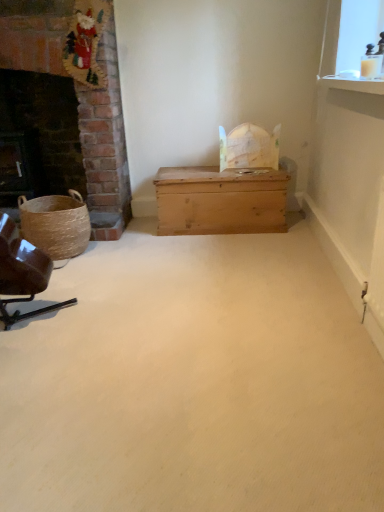
The height and width of the screenshot is (512, 384). What do you see at coordinates (220, 200) in the screenshot?
I see `light brown wooden chest at center` at bounding box center [220, 200].

In order to face brown leather chair at left, should I rotate leftwards or rightwards?

A 23.554 degree turn to the left will do.

At what (x,y) coordinates should I click in order to perform the action: click on dark brick fireplace at left. Please return your answer as a coordinate pair (x, y). The image size is (384, 512). Looking at the image, I should click on pyautogui.click(x=38, y=137).

Where is `woven brown basket at left`? woven brown basket at left is located at coordinates (56, 224).

In the image, is wooden trunk at center positioned in front of or behind light brown wooden chest at center?

wooden trunk at center is positioned closer to the viewer than light brown wooden chest at center.

Which is more to the right, wooden trunk at center or light brown wooden chest at center?

light brown wooden chest at center is more to the right.

What's the angular difference between wooden trunk at center and light brown wooden chest at center's facing directions?

The angle between the facing direction of wooden trunk at center and the facing direction of light brown wooden chest at center is 2.29 degrees.

Is wooden trunk at center turned away from light brown wooden chest at center?

That's not correct — wooden trunk at center is not looking away from light brown wooden chest at center.

Is brown leather chair at left to the right of woven brown basket at left from the viewer's perspective?

Correct, you'll find brown leather chair at left to the right of woven brown basket at left.

Considering the positions of point (3, 253) and point (68, 242), is point (3, 253) closer or farther from the camera than point (68, 242)?

Point (3, 253) is closer to the camera than point (68, 242).

Which object is thinner, brown leather chair at left or woven brown basket at left?

woven brown basket at left.

Which is behind, brown leather chair at left or woven brown basket at left?

woven brown basket at left is behind.

At what (x,y) coordinates should I click in order to perform the action: click on fireplace above the wooden trunk at center (from a real-world perspective). Please return your answer as a coordinate pair (x, y). Looking at the image, I should click on (38, 137).

Is wooden trunk at center placed right next to dark brick fireplace at left?

There is a gap between wooden trunk at center and dark brick fireplace at left.

Is point (339, 355) farther from viewer compared to point (73, 121)?

No.

Is wooden trunk at center further to the viewer compared to dark brick fireplace at left?

No, the depth of wooden trunk at center is less than that of dark brick fireplace at left.

Which of these two, wooden trunk at center or brown leather chair at left, is thinner?

With smaller width is brown leather chair at left.

From the image's perspective, is wooden trunk at center over brown leather chair at left?

No, from the image's perspective, wooden trunk at center is not on top of brown leather chair at left.

The width and height of the screenshot is (384, 512). In the image, there is a wooden trunk at center. What are the coordinates of `chair above it (from the image's perspective)` in the screenshot? It's located at (22, 273).

From a real-world perspective, is wooden trunk at center on brown leather chair at left?

No, from a real-world perspective, wooden trunk at center is not on top of brown leather chair at left.

Identify the location of chair that is above the wooden trunk at center (from the image's perspective). (22, 273).

From a real-world perspective, is brown leather chair at left beneath wooden trunk at center?

No, from a real-world perspective, brown leather chair at left is not below wooden trunk at center.

Is brown leather chair at left positioned with its back to wooden trunk at center?

That's not correct — brown leather chair at left is not looking away from wooden trunk at center.

Considering the relative positions of woven brown basket at left and light brown wooden chest at center in the image provided, is woven brown basket at left to the left or to the right of light brown wooden chest at center?

In the image, woven brown basket at left appears on the left side of light brown wooden chest at center.

Which of these two, woven brown basket at left or light brown wooden chest at center, is bigger?

light brown wooden chest at center is bigger.

Is woven brown basket at left situated inside light brown wooden chest at center or outside?

woven brown basket at left is spatially situated outside light brown wooden chest at center.

The image size is (384, 512). Identify the location of basket below the light brown wooden chest at center (from the image's perspective). click(56, 224).

Is brown leather chair at left shorter than light brown wooden chest at center?

No.

Is brown leather chair at left located outside light brown wooden chest at center?

Yes, brown leather chair at left is not within light brown wooden chest at center.

Consider the image. Between brown leather chair at left and light brown wooden chest at center, which one has larger size?

light brown wooden chest at center.

Where is `plain below the light brown wooden chest at center (from a real-world perspective)`? plain below the light brown wooden chest at center (from a real-world perspective) is located at coordinates (193, 381).

Locate an element on the screen. Image resolution: width=384 pixels, height=512 pixels. basket on the left of brown leather chair at left is located at coordinates click(56, 224).

Estimate the real-world distances between objects in this image. Which object is closer to woven brown basket at left, brown leather chair at left or dark brick fireplace at left?

brown leather chair at left is closer to woven brown basket at left.

Considering their positions, is wooden trunk at center positioned closer to dark brick fireplace at left than brown leather chair at left?

brown leather chair at left.

Which object lies further to the anchor point woven brown basket at left, dark brick fireplace at left or brown leather chair at left?

dark brick fireplace at left.

Looking at the image, which one is located closer to wooden trunk at center, brown leather chair at left or light brown wooden chest at center?

Based on the image, brown leather chair at left appears to be nearer to wooden trunk at center.

Which object lies further to the anchor point woven brown basket at left, dark brick fireplace at left or light brown wooden chest at center?

Among the two, light brown wooden chest at center is located further to woven brown basket at left.

Looking at the image, which one is located closer to wooden trunk at center, dark brick fireplace at left or brown leather chair at left?

Based on the image, brown leather chair at left appears to be nearer to wooden trunk at center.

Which object lies nearer to the anchor point woven brown basket at left, brown leather chair at left or light brown wooden chest at center?

brown leather chair at left.

Which object lies further to the anchor point woven brown basket at left, wooden trunk at center or light brown wooden chest at center?

Among the two, wooden trunk at center is located further to woven brown basket at left.

I want to click on chair between wooden trunk at center and woven brown basket at left in the front-back direction, so click(22, 273).

At what (x,y) coordinates should I click in order to perform the action: click on chair positioned between wooden trunk at center and dark brick fireplace at left from near to far. Please return your answer as a coordinate pair (x, y). The image size is (384, 512). Looking at the image, I should click on (22, 273).

The width and height of the screenshot is (384, 512). I want to click on table between wooden trunk at center and dark brick fireplace at left in the front-back direction, so tap(220, 200).

I want to click on chair between dark brick fireplace at left and light brown wooden chest at center from left to right, so (22, 273).